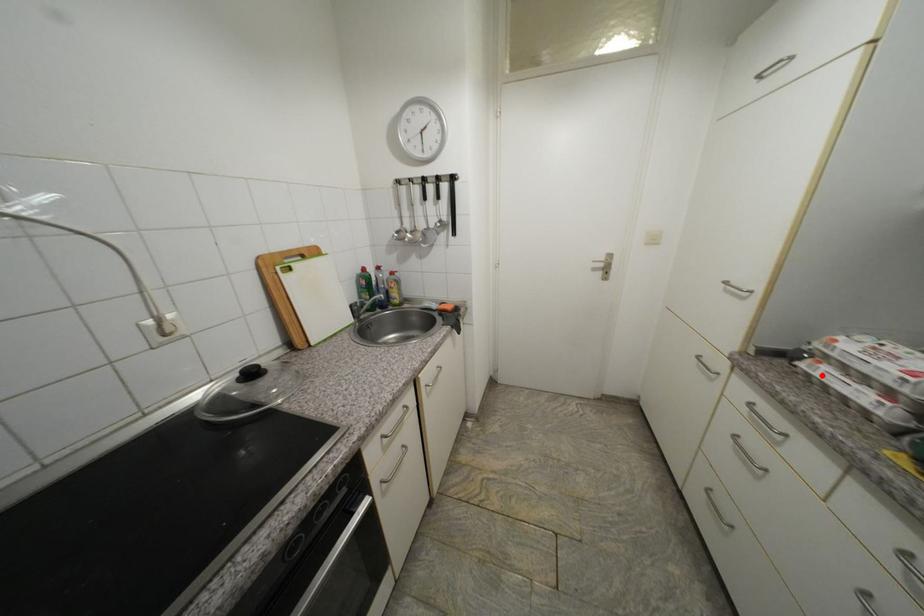
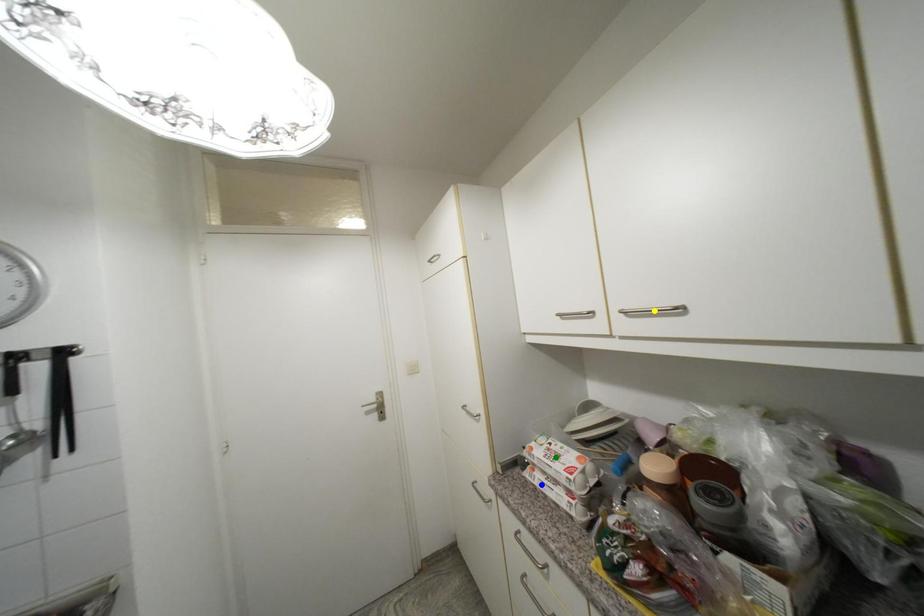
Question: I am providing you with two images of the same scene from different viewpoints. A red point is marked on the first image. You are given multiple points on the second image. Which point in image 2 represents the same 3d spot as the red point in image 1?

Choices:
 (A) green point
 (B) yellow point
 (C) blue point

Answer: (C)